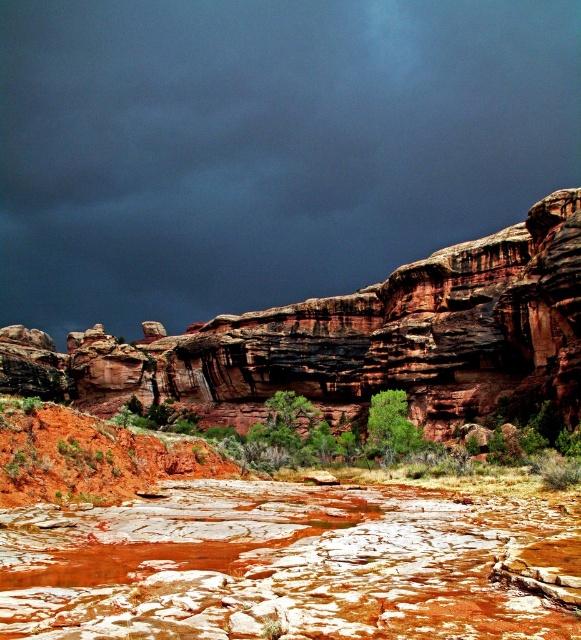
You are a hiker planning to take a photo of the rustic sandstone cliff at center from the dark gray cloud at upper center. Given that your camera has a maximum focus range of 200 meters, will you be able to capture the cliff clearly?

The dark gray cloud at upper center is 207.58 meters from the rustic sandstone cliff at center. Since the distance exceeds the camera maximum focus range of 200 meters, you won answer be able to capture the cliff clearly.

You are standing at the point closest to the viewer in this landscape. Which point, point (x=30, y=614) or point (x=417, y=346), is closer to you?

Point (x=30, y=614) is closer to you because it is in front of point (x=417, y=346).